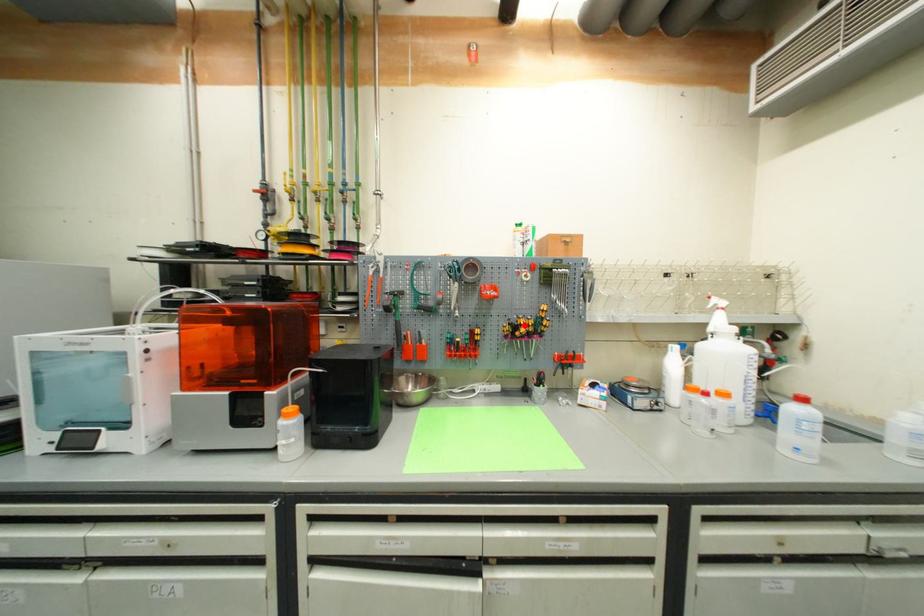
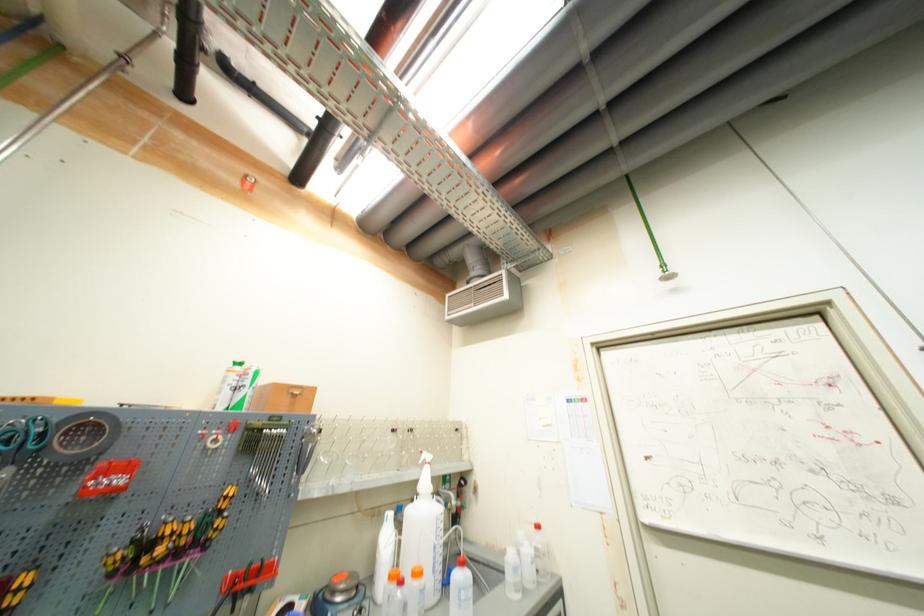
The point at the highlighted location is marked in the first image. Where is the corresponding point in the second image?

(165, 537)